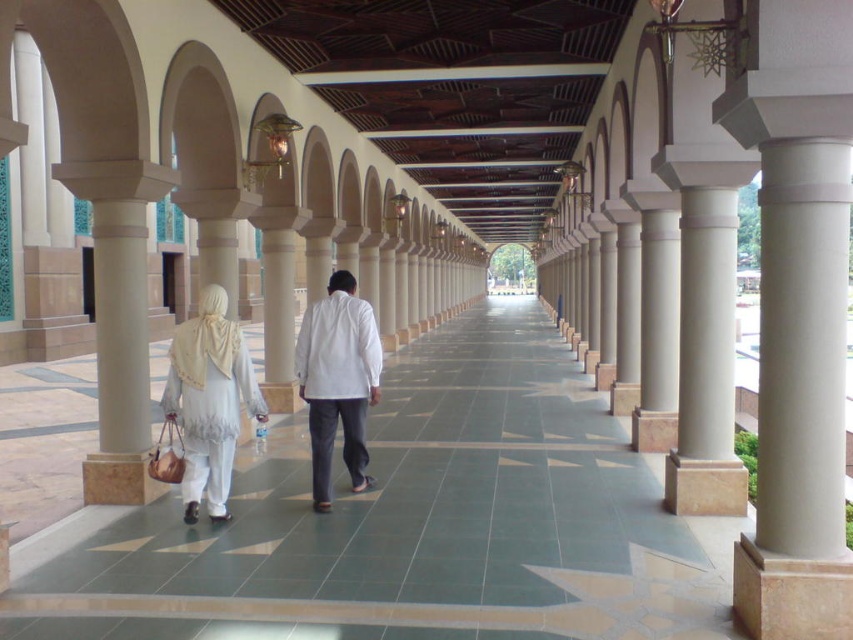
You are standing at the entrance of the walkway and see a light beige fabric dress at center and a white matte shirt at center. Which clothing item is more to the right?

The light beige fabric dress at center is more to the right because it is positioned on the right side of the white matte shirt at center.

You are standing in the walkway and notice both the smooth stone corridor at center and the white matte shirt at center. Which object is shorter in height?

The smooth stone corridor at center is shorter in height compared to the white matte shirt at center.